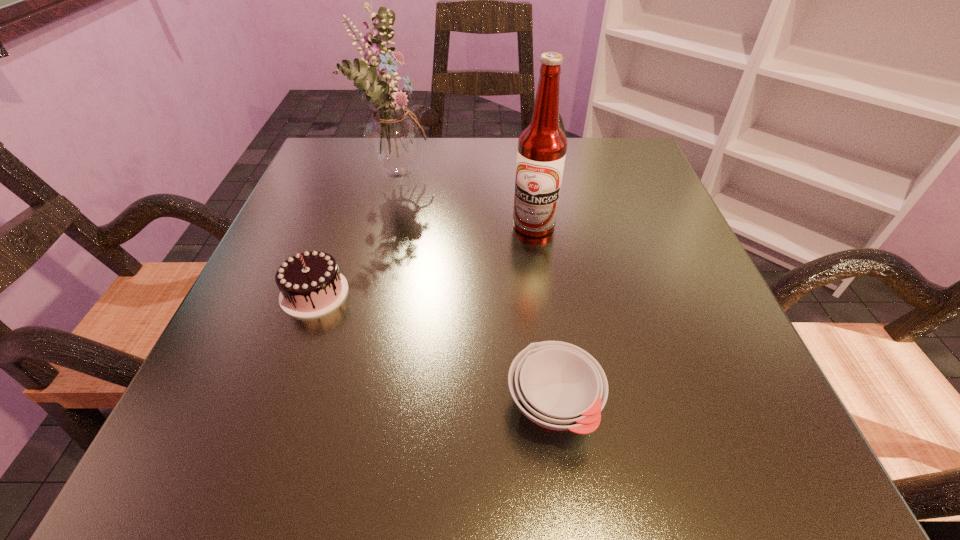
Image resolution: width=960 pixels, height=540 pixels. Find the location of `object at the far edge`. object at the far edge is located at coordinates (393, 138).

At what (x,y) coordinates should I click in order to perform the action: click on object situated at the near edge. Please return your answer as a coordinate pair (x, y). Image resolution: width=960 pixels, height=540 pixels. Looking at the image, I should click on (557, 385).

Where is `bouquet present at the left edge`? The image size is (960, 540). bouquet present at the left edge is located at coordinates (393, 138).

You are a GUI agent. You are given a task and a screenshot of the screen. Output one action in this format:
    pyautogui.click(x=<x>, y=<y>)
    Task: Click on the chocolate cake that is at the left edge
    
    Given the screenshot: What is the action you would take?
    [x=310, y=284]

Where is `object located at the far left corner`? The width and height of the screenshot is (960, 540). object located at the far left corner is located at coordinates (393, 138).

This screenshot has height=540, width=960. What are the coordinates of `free region at the far edge of the desktop` in the screenshot? It's located at (502, 148).

Find the location of a particular element. The width and height of the screenshot is (960, 540). vacant space at the near edge of the desktop is located at coordinates (413, 439).

Find the location of `free region at the left edge`. free region at the left edge is located at coordinates (294, 215).

This screenshot has width=960, height=540. What are the coordinates of `vacant region at the right edge` in the screenshot? It's located at (716, 352).

Where is `blank space at the far left corner of the desktop`? blank space at the far left corner of the desktop is located at coordinates (356, 137).